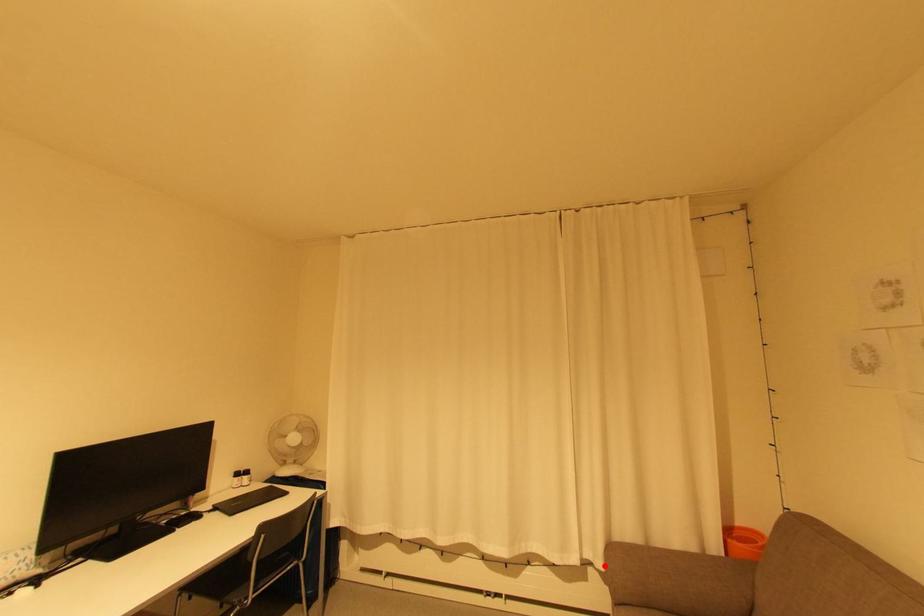
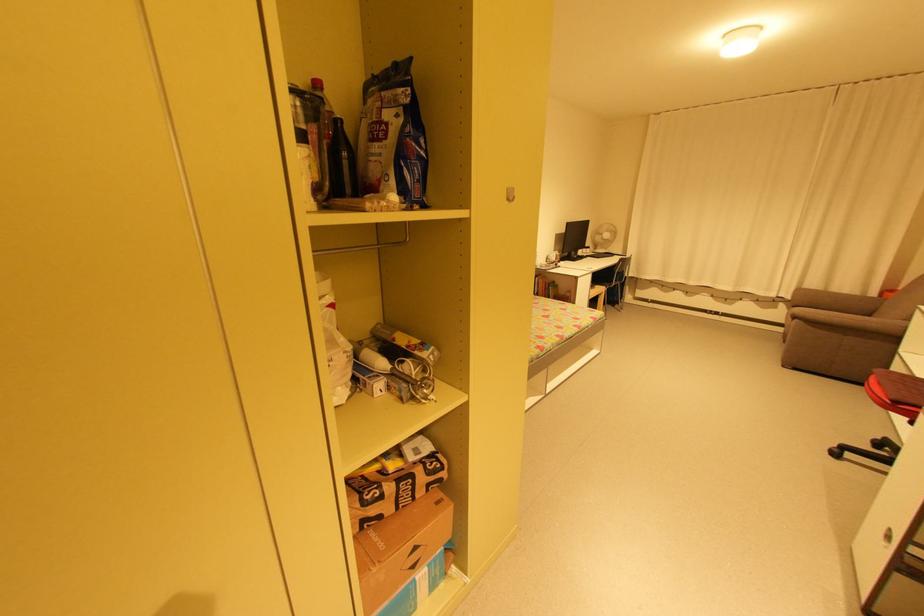
Question: I am providing you with two images of the same scene from different viewpoints. In image1, a red point is highlighted. Considering the same 3D point in image2, which of the following is correct?

Choices:
 (A) It is closer
 (B) It is farther

Answer: (B)